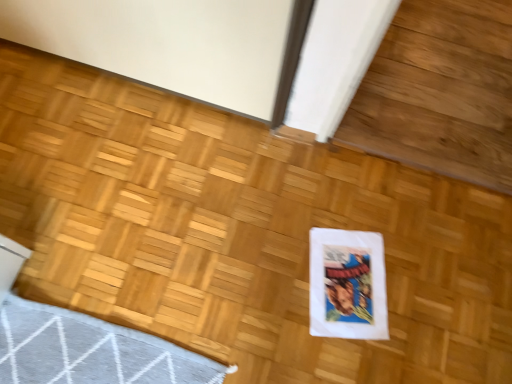
Find the location of a particular element. The image size is (512, 384). vacant area on top of white paper comic book at lower right (from a real-world perspective) is located at coordinates (344, 285).